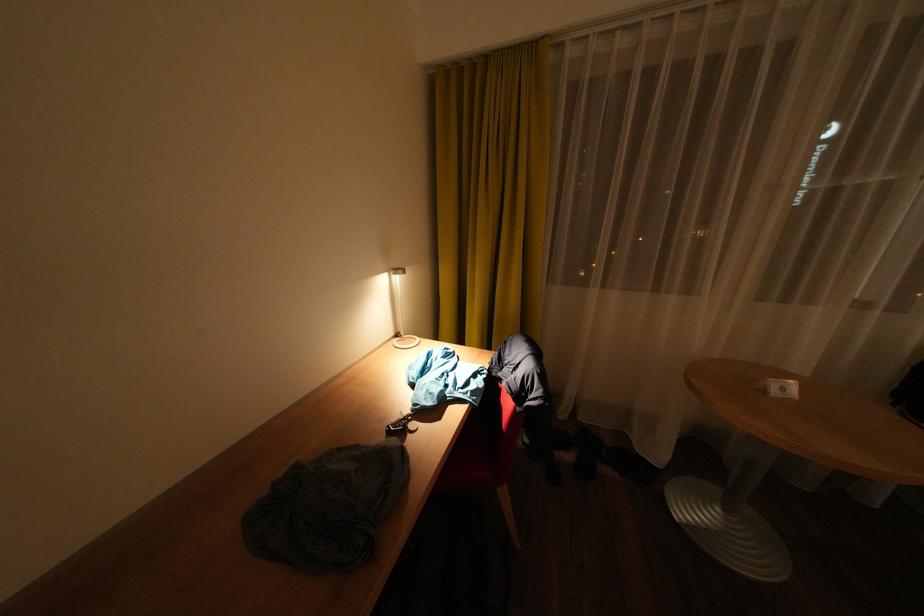
Where is `set of keys`? set of keys is located at coordinates (399, 426).